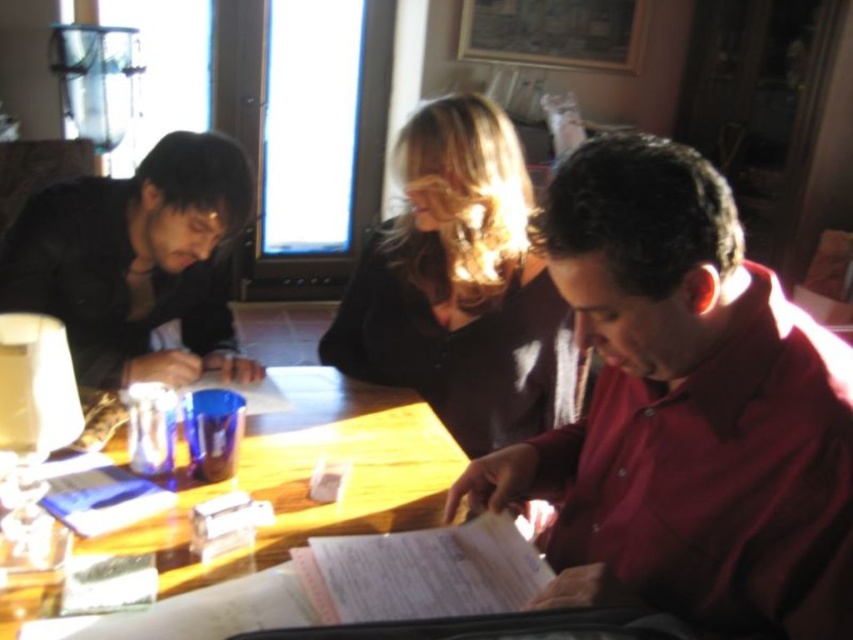
Question: Is matte red shirt at center in front of wooden table at center?

Choices:
 (A) yes
 (B) no

Answer: (A)

Question: Which point is closer to the camera?

Choices:
 (A) (775, 317)
 (B) (277, 369)
 (C) (465, 436)

Answer: (A)

Question: Which point is farther to the camera?

Choices:
 (A) matte black sweater at center
 (B) matte red shirt at center
 (C) wooden table at center

Answer: (A)

Question: Which of these objects is positioned closest to the matte black sweater at center?

Choices:
 (A) wooden table at center
 (B) matte red shirt at center

Answer: (A)

Question: Can you confirm if matte red shirt at center is thinner than wooden table at center?

Choices:
 (A) yes
 (B) no

Answer: (A)

Question: Does matte red shirt at center appear under wooden table at center?

Choices:
 (A) yes
 (B) no

Answer: (B)